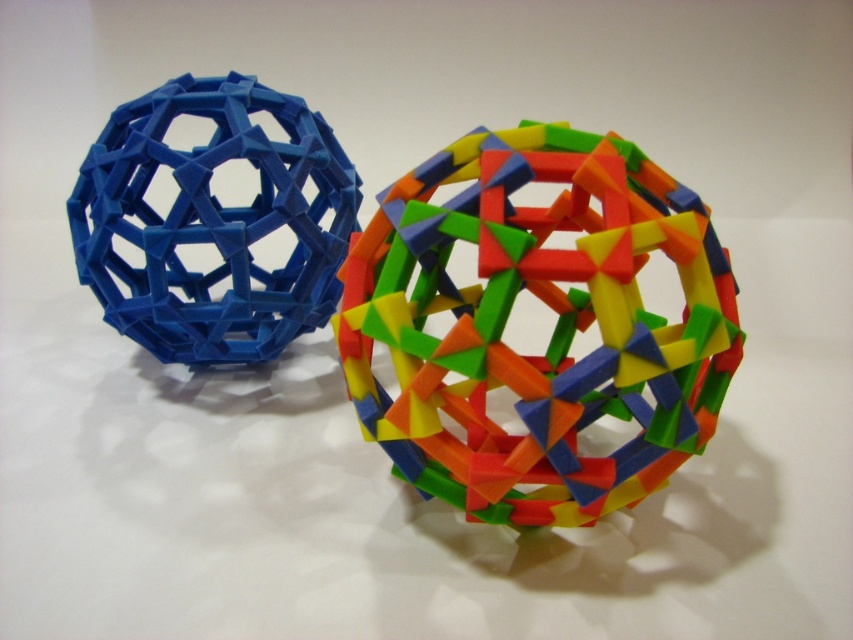
Between multicolored plastic geometric ball at center and matte blue plastic sphere at left, which one is positioned higher?

matte blue plastic sphere at left is above.

Which is in front, point (560, 420) or point (82, 170)?

Point (560, 420)

Who is more forward, (622, 492) or (287, 211)?

Point (622, 492)

Where is `multicolored plastic geometric ball at center`? This screenshot has width=853, height=640. multicolored plastic geometric ball at center is located at coordinates (553, 330).